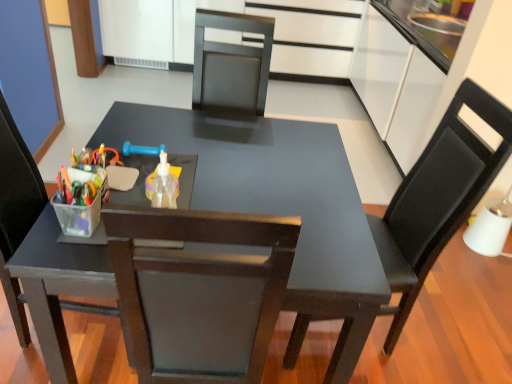
Question: Does matte black chair at left, which is the first chair in left-to-right order, have a lesser height compared to matte black table at center?

Choices:
 (A) no
 (B) yes

Answer: (A)

Question: Is the position of matte black chair at left, which is the first chair in left-to-right order, more distant than that of matte black table at center?

Choices:
 (A) no
 (B) yes

Answer: (A)

Question: Does matte black chair at left, which is the first chair in left-to-right order, have a smaller size compared to matte black table at center?

Choices:
 (A) no
 (B) yes

Answer: (B)

Question: From a real-world perspective, is matte black chair at left, acting as the second chair starting from the right, located beneath matte black table at center?

Choices:
 (A) yes
 (B) no

Answer: (B)

Question: Is matte black chair at left, which is the first chair in left-to-right order, at the left side of matte black table at center?

Choices:
 (A) yes
 (B) no

Answer: (A)

Question: From their relative heights in the image, would you say translucent plastic bottle at center is taller or shorter than white glossy drawer at upper center?

Choices:
 (A) tall
 (B) short

Answer: (B)

Question: Is translucent plastic bottle at center inside or outside of white glossy drawer at upper center?

Choices:
 (A) inside
 (B) outside

Answer: (B)

Question: From a real-world perspective, is translucent plastic bottle at center above or below white glossy drawer at upper center?

Choices:
 (A) below
 (B) above

Answer: (B)

Question: In the image, is translucent plastic bottle at center on the left side or the right side of white glossy drawer at upper center?

Choices:
 (A) left
 (B) right

Answer: (A)

Question: From the image's perspective, is matte black chair at left, acting as the second chair starting from the right, located above or below white glossy drawer at upper center?

Choices:
 (A) above
 (B) below

Answer: (B)

Question: Considering the relative positions of matte black chair at left, which is the first chair in left-to-right order, and white glossy drawer at upper center in the image provided, is matte black chair at left, which is the first chair in left-to-right order, to the left or to the right of white glossy drawer at upper center?

Choices:
 (A) right
 (B) left

Answer: (B)

Question: Looking at the image, does matte black chair at left, acting as the second chair starting from the right, seem bigger or smaller compared to white glossy drawer at upper center?

Choices:
 (A) small
 (B) big

Answer: (A)

Question: In terms of height, does matte black chair at left, which is the first chair in left-to-right order, look taller or shorter compared to white glossy drawer at upper center?

Choices:
 (A) short
 (B) tall

Answer: (B)

Question: Is white glossy drawer at upper center wider or thinner than matte black table at center?

Choices:
 (A) wide
 (B) thin

Answer: (B)

Question: Considering the positions of point (318, 41) and point (38, 246), is point (318, 41) closer or farther from the camera than point (38, 246)?

Choices:
 (A) farther
 (B) closer

Answer: (A)